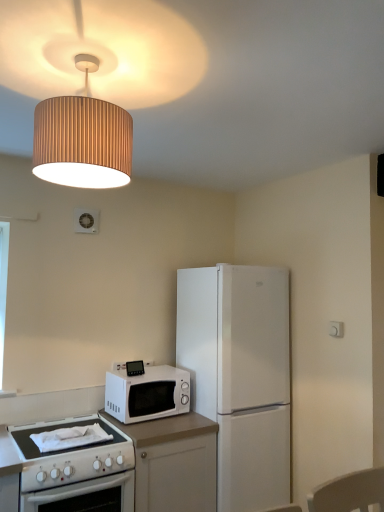
Question: Is white laminate countertop at lower left closer to camera compared to white matte microwave at center?

Choices:
 (A) yes
 (B) no

Answer: (A)

Question: Can you confirm if white laminate countertop at lower left is thinner than white matte microwave at center?

Choices:
 (A) yes
 (B) no

Answer: (B)

Question: Is white laminate countertop at lower left not close to white matte microwave at center?

Choices:
 (A) yes
 (B) no

Answer: (B)

Question: Is white matte microwave at center at the back of white laminate countertop at lower left?

Choices:
 (A) yes
 (B) no

Answer: (B)

Question: Can white matte microwave at center be found inside white laminate countertop at lower left?

Choices:
 (A) yes
 (B) no

Answer: (B)

Question: Is white laminate countertop at lower left to the left of white matte microwave at center from the viewer's perspective?

Choices:
 (A) no
 (B) yes

Answer: (A)

Question: Is white matte refrigerator at center-right further to camera compared to wooden lampshade at upper center?

Choices:
 (A) yes
 (B) no

Answer: (A)

Question: Considering the relative positions of white matte refrigerator at center-right and wooden lampshade at upper center in the image provided, is white matte refrigerator at center-right to the right of wooden lampshade at upper center from the viewer's perspective?

Choices:
 (A) no
 (B) yes

Answer: (B)

Question: Considering the relative positions of white matte refrigerator at center-right and wooden lampshade at upper center in the image provided, is white matte refrigerator at center-right in front of wooden lampshade at upper center?

Choices:
 (A) no
 (B) yes

Answer: (A)

Question: Is white matte refrigerator at center-right aimed at wooden lampshade at upper center?

Choices:
 (A) yes
 (B) no

Answer: (B)

Question: Can you confirm if white matte refrigerator at center-right is shorter than wooden lampshade at upper center?

Choices:
 (A) yes
 (B) no

Answer: (B)

Question: From the image's perspective, is white matte refrigerator at center-right under wooden lampshade at upper center?

Choices:
 (A) no
 (B) yes

Answer: (B)

Question: Is white matte microwave at center next to white laminate countertop at lower left and touching it?

Choices:
 (A) yes
 (B) no

Answer: (B)